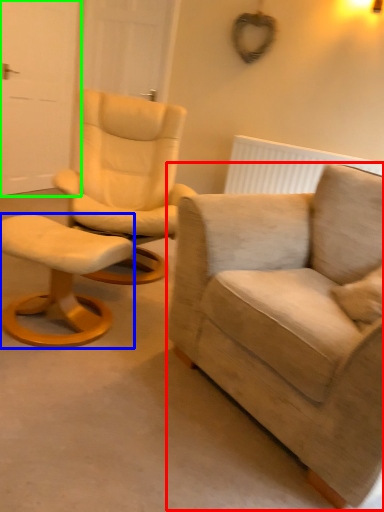
Question: Considering the real-world distances, which object is closest to chair (highlighted by a red box)? stool (highlighted by a blue box) or door (highlighted by a green box).

Choices:
 (A) stool
 (B) door

Answer: (A)